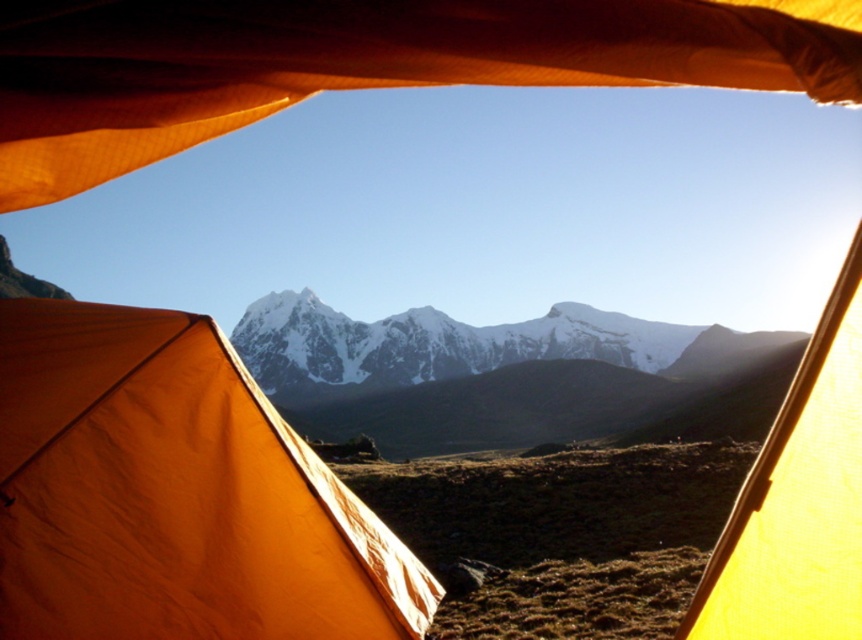
Can you confirm if orange fabric tent at center is bigger than snowy granite mountain range at center?

No.

Who is more forward, [242,452] or [534,394]?

Point [242,452] is in front.

Image resolution: width=862 pixels, height=640 pixels. Identify the location of orange fabric tent at center. (173, 493).

Who is taller, orange fabric tent at center or orange fabric canopy at upper center?

With more height is orange fabric tent at center.

Between point (248, 390) and point (408, 72), which one is positioned behind?

Point (248, 390)

Between point (97, 502) and point (776, 28), which one is positioned in front?

Point (776, 28) is in front.

Where is `orange fabric tent at center`? orange fabric tent at center is located at coordinates (173, 493).

Does orange fabric canopy at upper center appear under snowy granite mountain range at center?

No.

Who is positioned more to the left, orange fabric canopy at upper center or snowy granite mountain range at center?

Positioned to the left is orange fabric canopy at upper center.

This screenshot has width=862, height=640. I want to click on orange fabric canopy at upper center, so click(x=360, y=64).